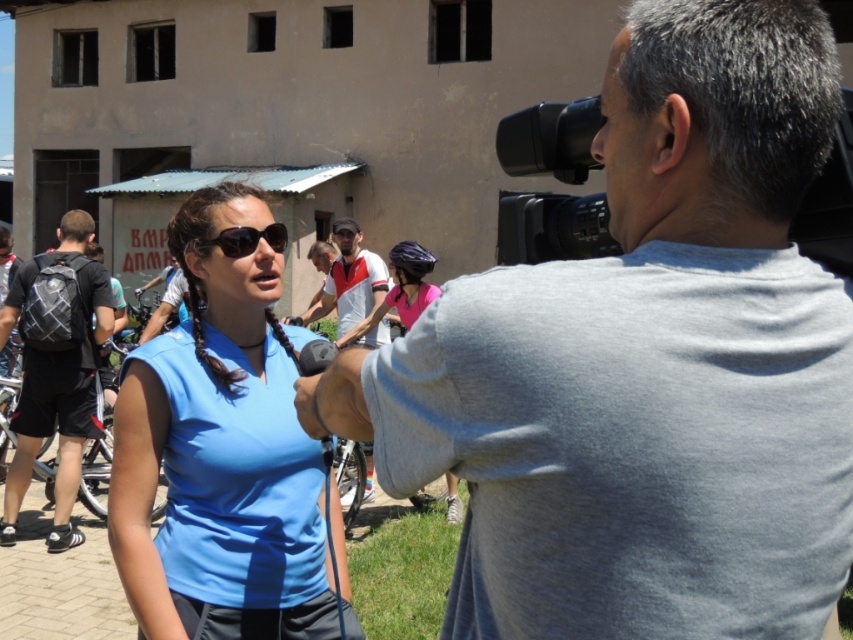
Question: Considering the real-world distances, which object is farthest from the black mesh backpack at left?

Choices:
 (A) gray cotton shirt at upper right
 (B) black matte sunglasses at center

Answer: (A)

Question: In this image, where is gray cotton shirt at upper right located relative to black mesh backpack at left?

Choices:
 (A) left
 (B) right

Answer: (B)

Question: Which point appears farthest from the camera in this image?

Choices:
 (A) (180, 595)
 (B) (604, 228)

Answer: (A)

Question: Is blue fabric shirt at center further to the viewer compared to white cotton shirt at center?

Choices:
 (A) no
 (B) yes

Answer: (A)

Question: Which point appears closest to the camera in this image?

Choices:
 (A) (80, 358)
 (B) (525, 172)
 (C) (343, 252)

Answer: (B)

Question: Can you confirm if black plastic video camera at upper right is positioned below black matte sunglasses at center?

Choices:
 (A) yes
 (B) no

Answer: (B)